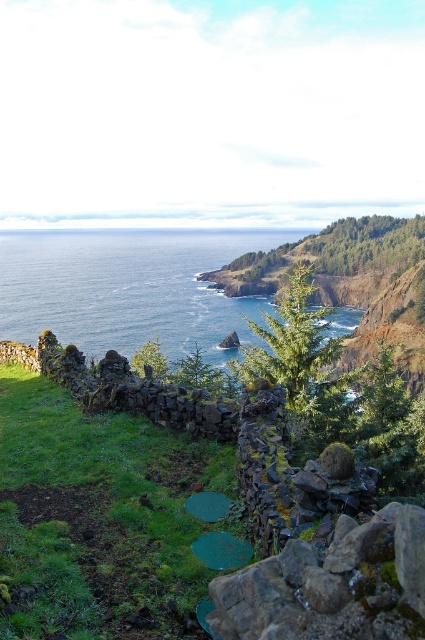
You are standing at the point marked by point [99,518] in the image. Looking around, you see a rugged coastline with cliffs dropping into the ocean. Which direction should you walk to reach the grassy area with patches of dirt?

The point [99,518] is located at the green grass at lower left, which is part of the grassy area with patches of dirt described in the scene. Therefore, you are already in the grassy area with patches of dirt and do not need to move further.

You are standing at the center of the image and want to walk towards the green grass at lower left. Which direction should you face to move directly towards it?

To move directly towards the green grass at lower left from the center of the image, you should face the lower left direction.